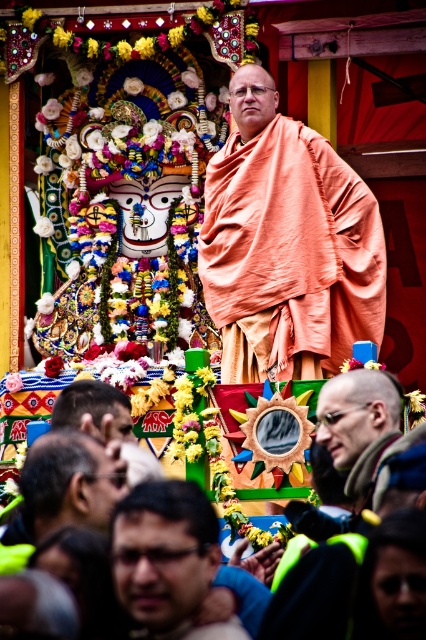
You are a photographer at the festival, and you want to capture both the bald head at center and the brown hair at lower left in a single frame. Which of the two objects would require you to adjust your camera angle more to ensure they are both in focus?

The bald head at center has a lesser width compared to brown hair at lower left. Since the bald head is narrower, it might be easier to keep in focus while adjusting for the wider brown hair at lower left, requiring more careful angle adjustment to ensure both are sharp.

In the festival scene, you see a bald head at center and brown hair at lower left. Which one is smaller?

The bald head at center is smaller than brown hair at lower left.